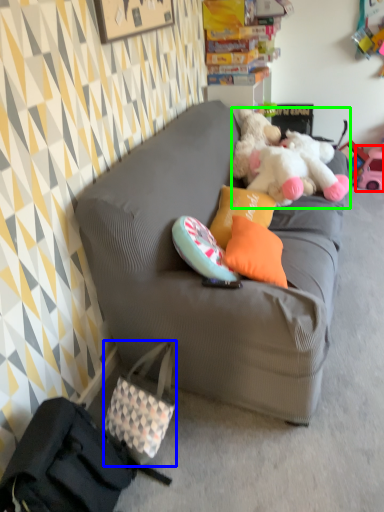
Question: Based on their relative distances, which object is farther from toy (highlighted by a red box)? Choose from handbag (highlighted by a blue box) and teddy bear (highlighted by a green box).

Choices:
 (A) handbag
 (B) teddy bear

Answer: (A)